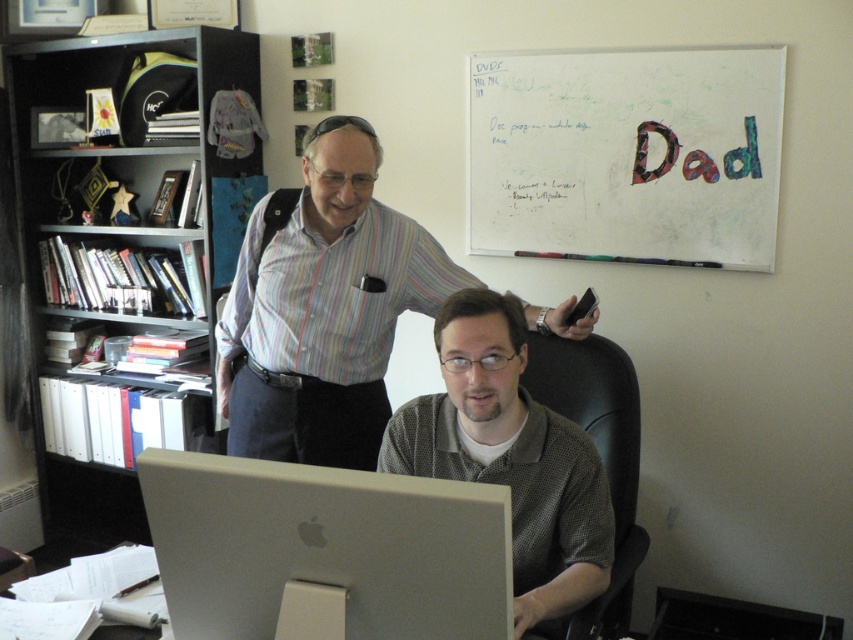
You are a delivery person carrying a package that is 1.2 meters long. You need to place it between the black plastic bookshelf at left and the whiteboard with colorful markers at upper right. Is there enough space between them to fit the package?

The black plastic bookshelf at left and whiteboard with colorful markers at upper right are 1.21 meters apart. Since the package is 1.2 meters long, there is enough space between them to fit the package as the distance is slightly more than the package length.

You are standing in an office and see two points marked on the floor. The first point is at coordinates point (306, 250) and the second point is at point (549, 394). If you want to walk from the first point to the second point, will you need to go around the desk?

Point (306, 250) is in front of point (549, 394), so you can walk directly from the first point to the second point without needing to go around the desk.

You are an office worker who needs to write an important note. You have a whiteboard with colorful markers at upper right and a silver metallic monitor at center. Which object is located to the right side of the other?

The whiteboard with colorful markers at upper right is to the right of the silver metallic monitor at center.